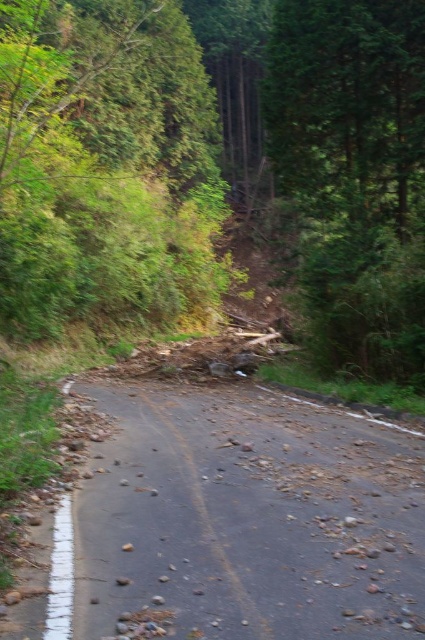
You are a hiker trying to navigate the damaged road. You see the dull asphalt road at center and the green leafy tree at upper left. Which one is closer to you as you stand on the path?

The dull asphalt road at center is closer to you because it is in front of the green leafy tree at upper left.